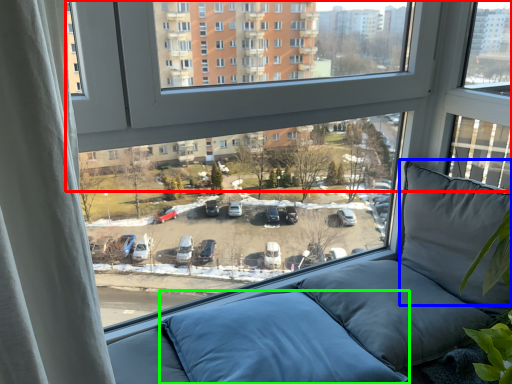
Question: Based on their relative distances, which object is nearer to window (highlighted by a red box)? Choose from pillow (highlighted by a blue box) and pillow (highlighted by a green box).

Choices:
 (A) pillow
 (B) pillow

Answer: (A)